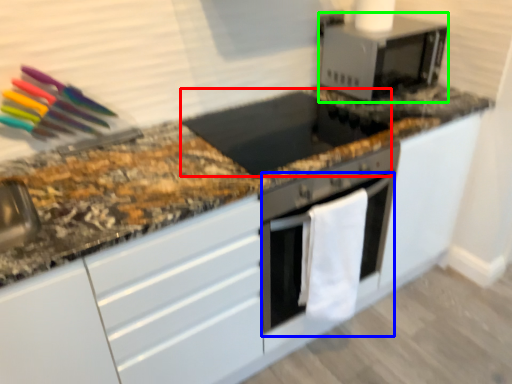
Question: Which object is the closest to the appliance (highlighted by a red box)? Choose among these: oven (highlighted by a blue box) or microwave oven (highlighted by a green box).

Choices:
 (A) oven
 (B) microwave oven

Answer: (B)